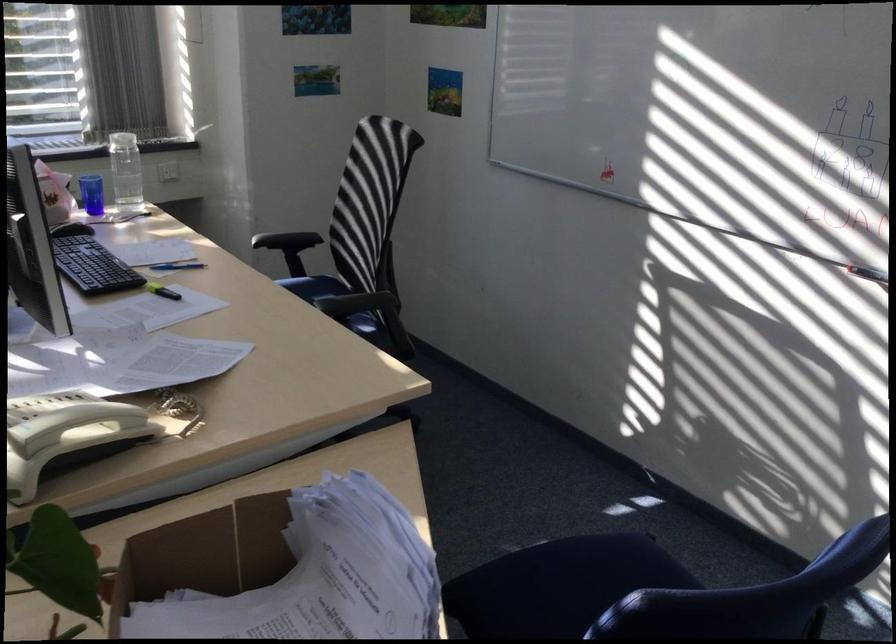
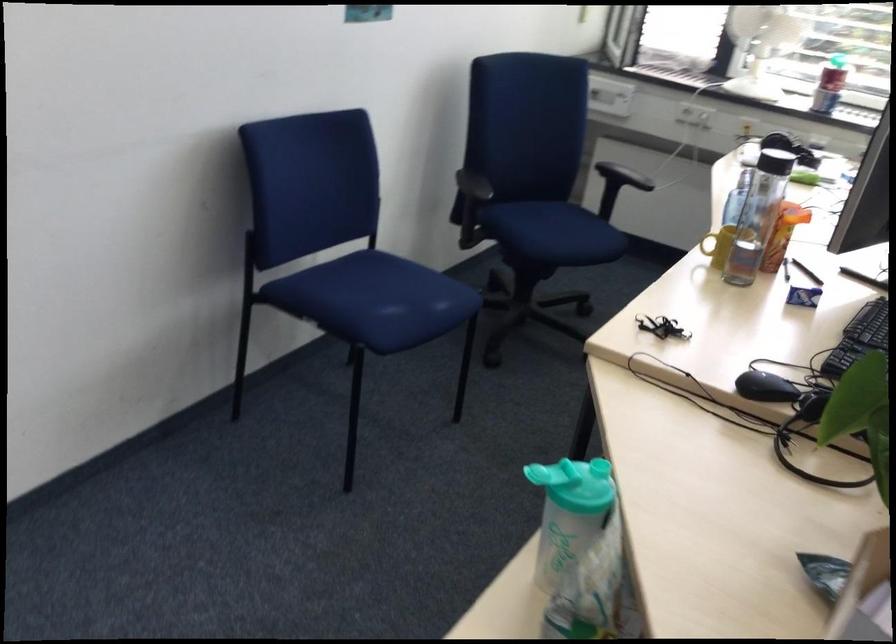
How did the camera likely rotate?

The camera rotated toward left-down.